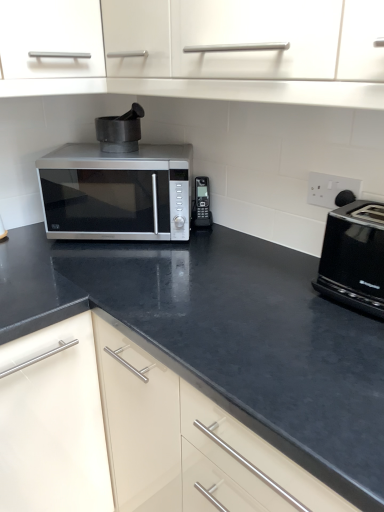
The width and height of the screenshot is (384, 512). In order to click on vacant space in front of black matte mortar at center, the 1th appliance from the top in this screenshot , I will do `click(126, 156)`.